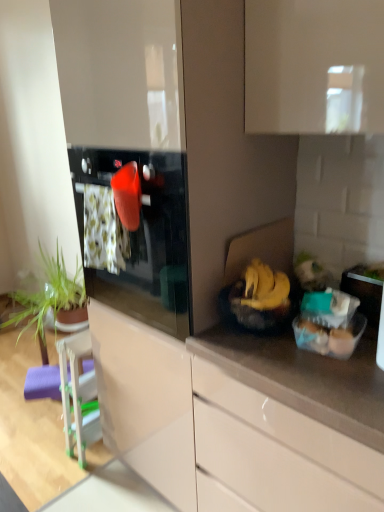
Where is `vacant area situated to the left side of white glossy chair at lower left, positioned as the second appliance in right-to-left order`? This screenshot has width=384, height=512. vacant area situated to the left side of white glossy chair at lower left, positioned as the second appliance in right-to-left order is located at coordinates (50, 453).